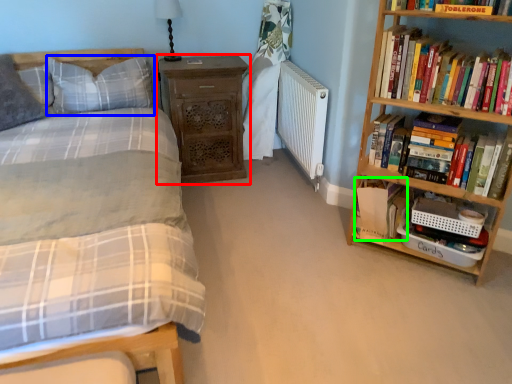
Question: Which is nearer to the nightstand (highlighted by a red box)? pillow (highlighted by a blue box) or book (highlighted by a green box).

Choices:
 (A) pillow
 (B) book

Answer: (A)